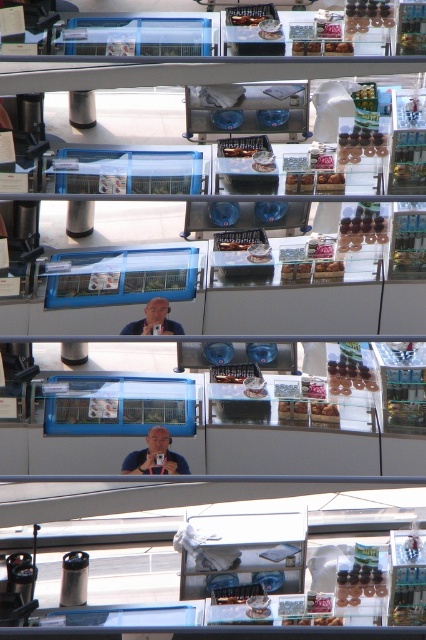
In the scene shown: Does smooth skin selfie at center have a greater width compared to matte blue shirt at center?

Result: Yes.

Does smooth skin selfie at center appear over matte blue shirt at center?

No.

Between point (158, 467) and point (167, 330), which one is positioned behind?

The point (167, 330) is more distant.

I want to click on smooth skin selfie at center, so click(155, 456).